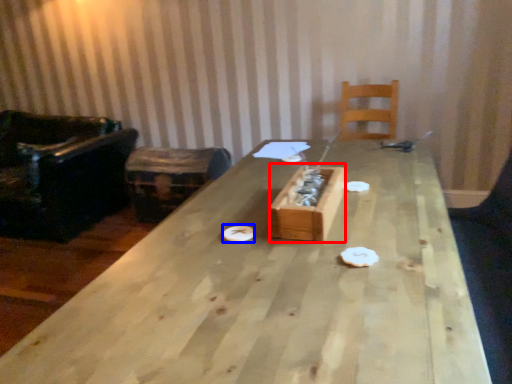
Question: Which of the following is the closest to the observer, cardboard box (highlighted by a red box) or paper plate (highlighted by a blue box)?

Choices:
 (A) cardboard box
 (B) paper plate

Answer: (A)